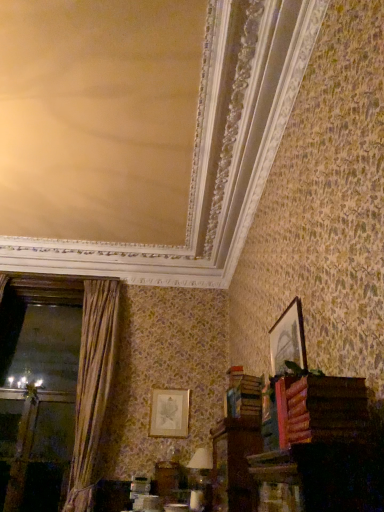
Question: Is the depth of wooden book at lower right, which is the 1th book from back to front, greater than that of gold fabric curtain at left?

Choices:
 (A) yes
 (B) no

Answer: (B)

Question: Is wooden book at lower right, which ranks as the 1th book in bottom-to-top order, taller than gold fabric curtain at left?

Choices:
 (A) no
 (B) yes

Answer: (A)

Question: Can you confirm if wooden book at lower right, which is the 1th book from back to front, is thinner than gold fabric curtain at left?

Choices:
 (A) yes
 (B) no

Answer: (A)

Question: From the image's perspective, is wooden book at lower right, the 2th book from the front, over gold fabric curtain at left?

Choices:
 (A) yes
 (B) no

Answer: (A)

Question: From a real-world perspective, is wooden book at lower right, which is the 1th book from back to front, located higher than gold fabric curtain at left?

Choices:
 (A) yes
 (B) no

Answer: (B)

Question: Considering the relative sizes of wooden book at lower right, which is the 1th book from back to front, and gold fabric curtain at left in the image provided, is wooden book at lower right, which is the 1th book from back to front, wider than gold fabric curtain at left?

Choices:
 (A) no
 (B) yes

Answer: (A)

Question: Is wooden book at lower right, the 2th book from the front, shorter than matte silver picture frame at center, which ranks as the 2th picture frame in right-to-left order?

Choices:
 (A) yes
 (B) no

Answer: (A)

Question: Is wooden book at lower right, which ranks as the 1th book in bottom-to-top order, oriented away from matte silver picture frame at center, the first picture frame positioned from the back?

Choices:
 (A) yes
 (B) no

Answer: (B)

Question: Is wooden book at lower right, the 2th book from the front, smaller than matte silver picture frame at center, the first picture frame positioned from the back?

Choices:
 (A) no
 (B) yes

Answer: (A)

Question: Is wooden book at lower right, which ranks as the 1th book in bottom-to-top order, further to camera compared to matte silver picture frame at center, which ranks as the 1th picture frame in left-to-right order?

Choices:
 (A) no
 (B) yes

Answer: (A)

Question: Considering the relative sizes of wooden book at lower right, the 2th book from the front, and matte silver picture frame at center, which ranks as the 2th picture frame in right-to-left order, in the image provided, is wooden book at lower right, the 2th book from the front, taller than matte silver picture frame at center, which ranks as the 2th picture frame in right-to-left order,?

Choices:
 (A) yes
 (B) no

Answer: (B)

Question: Is wooden book at lower right, which is the second book in top-to-bottom order, positioned far away from matte silver picture frame at center, the 2th picture frame positioned from the front?

Choices:
 (A) no
 (B) yes

Answer: (B)

Question: From the image's perspective, is wooden book at lower right, which ranks as the 1th book in bottom-to-top order, over wooden book at lower right, which ranks as the 1th book in front-to-back order?

Choices:
 (A) yes
 (B) no

Answer: (B)